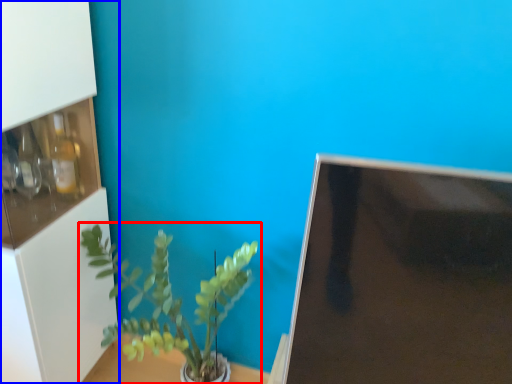
Question: Among these objects, which one is farthest to the camera, houseplant (highlighted by a red box) or shelf (highlighted by a blue box)?

Choices:
 (A) houseplant
 (B) shelf

Answer: (A)